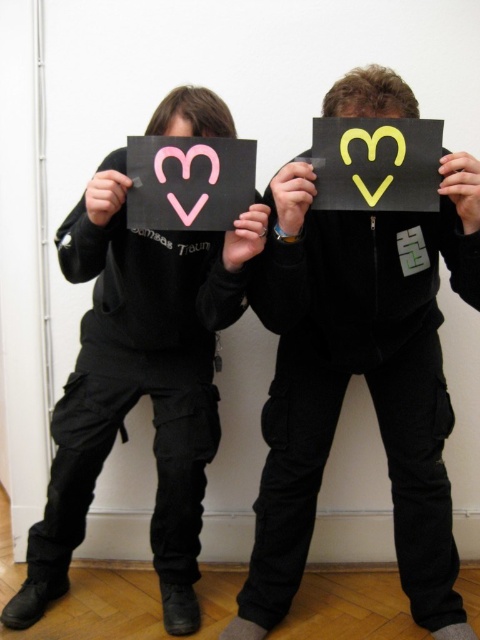
Who is positioned more to the left, yellow matte heart at center or matte black hair at upper center?

Positioned to the left is matte black hair at upper center.

What do you see at coordinates (375, 163) in the screenshot? Image resolution: width=480 pixels, height=640 pixels. I see `yellow matte heart at center` at bounding box center [375, 163].

Is point (331, 168) positioned after point (358, 96)?

Yes, it is.

Find the location of a particular element. The width and height of the screenshot is (480, 640). yellow matte heart at center is located at coordinates (375, 163).

Consider the image. Which is above, matte black hair at upper center or pink matte heart at upper left?

matte black hair at upper center is above.

Is matte black hair at upper center below pink matte heart at upper left?

Incorrect, matte black hair at upper center is not positioned below pink matte heart at upper left.

What do you see at coordinates (370, 93) in the screenshot? I see `matte black hair at upper center` at bounding box center [370, 93].

This screenshot has width=480, height=640. I want to click on matte black hair at upper center, so click(370, 93).

Is yellow matte heart at center to the left of pink matte heart at upper left from the viewer's perspective?

Incorrect, yellow matte heart at center is not on the left side of pink matte heart at upper left.

Who is more distant from viewer, (348, 186) or (204, 122)?

The point (204, 122) is more distant.

The image size is (480, 640). In order to click on yellow matte heart at center in this screenshot , I will do `click(375, 163)`.